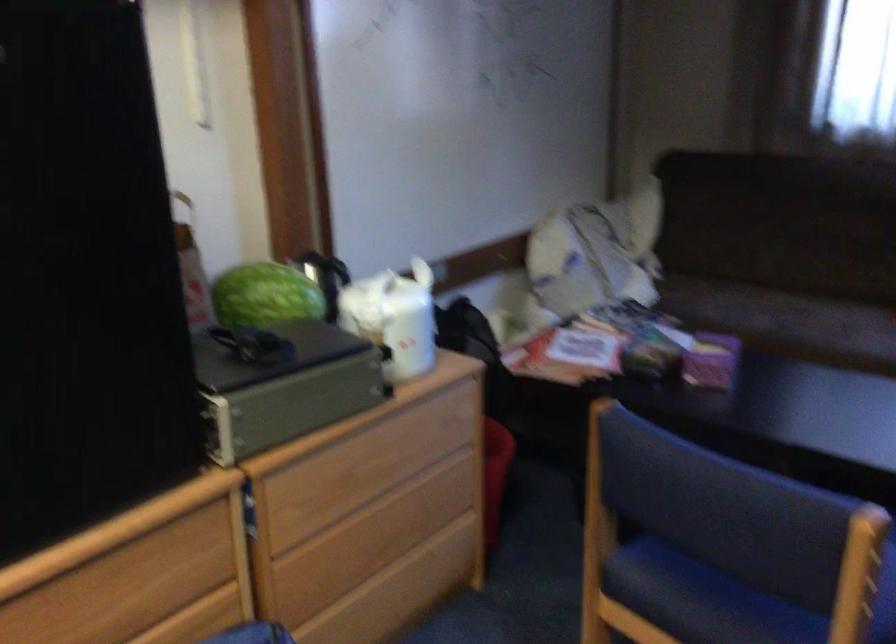
Where would you sit the chair sitting surface? Please return your answer as a coordinate pair (x, y).

(702, 599)